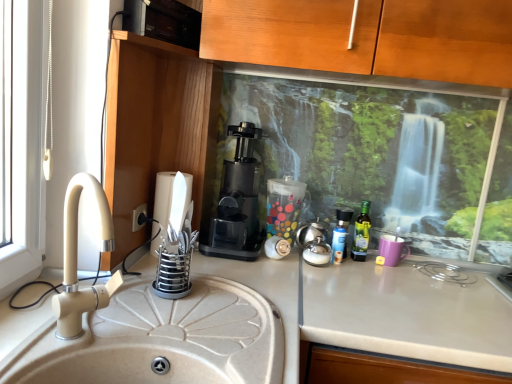
Question: Does point (346, 220) appear closer or farther from the camera than point (187, 187)?

Choices:
 (A) closer
 (B) farther

Answer: (B)

Question: From the image's perspective, is translucent plastic spray can at center, the first bottle in the left-to-right sequence, located above or below metallic silver knife block at left?

Choices:
 (A) below
 (B) above

Answer: (A)

Question: Which is farther from the green glass bottle at right, the first bottle in the right-to-left sequence?

Choices:
 (A) translucent plastic spray can at center, the first bottle in the left-to-right sequence
 (B) black plastic electric outlet at lower left
 (C) black plastic coffee machine at center
 (D) beige ceramic sink at left
 (E) white matte countertop at center

Answer: (D)

Question: Based on their relative distances, which object is nearer to the white matte countertop at center?

Choices:
 (A) metallic silver knife block at left
 (B) green glass bottle at right, which is counted as the second bottle, starting from the left
 (C) black plastic electric outlet at lower left
 (D) black plastic coffee machine at center
 (E) beige ceramic sink at left

Answer: (B)